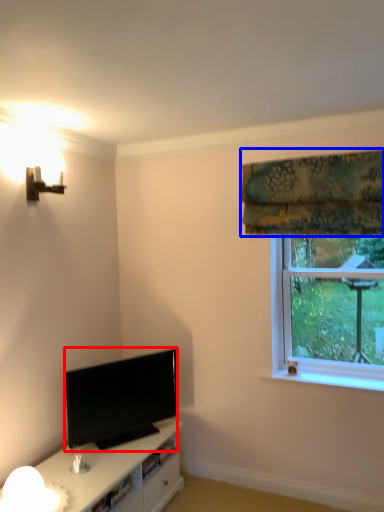
Question: Which point is further to the camera, television (highlighted by a red box) or curtain (highlighted by a blue box)?

Choices:
 (A) television
 (B) curtain

Answer: (A)